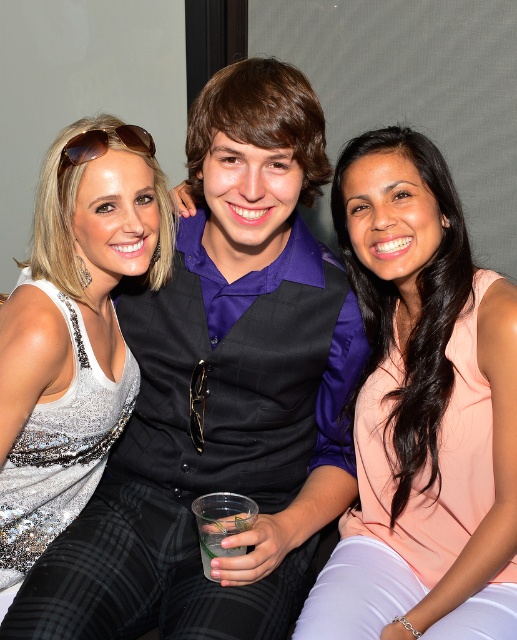
You are a photographer trying to capture a closeup of the matte black vest at center and the satin silver dress at center. The camera you are using has a maximum focus range of 6 inches. Will you be able to focus on both items simultaneously?

The matte black vest at center and satin silver dress at center are 6.35 inches apart. Since the camera can only focus within 6 inches, the distance between them exceeds the focus range. Therefore, you cannot focus on both items at the same time.

You are a photographer adjusting the lighting for a group photo. You need to ensure that the matte black vest at center and the peach satin blouse at center are both well lit. Based on their positions, which item is closer to the top of the image and should be adjusted first?

The matte black vest at center is above the peach satin blouse at center, so it is closer to the top of the image and should be adjusted first.